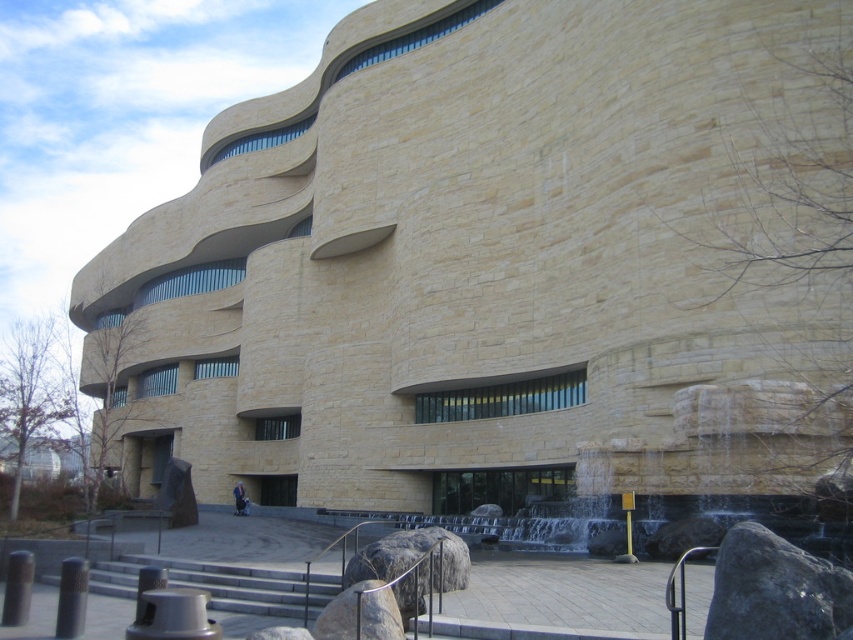
You are standing at the entrance of the building and see the point marked as point (775, 589). What object does this point correspond to?

The point (775, 589) corresponds to the dark gray rock at lower right.

You are standing at the entrance of the building and want to walk towards the waterfall. Which rock, the dark gray rock at lower right or the smooth gray rock at lower center, will you encounter first?

The dark gray rock at lower right is in front of the smooth gray rock at lower center, so you will encounter the dark gray rock at lower right first.